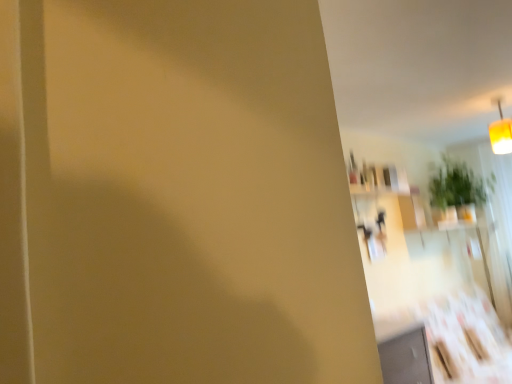
Question: From the image's perspective, relative to green leafy plant at upper right, is yellow fabric lampshade at upper right above or below?

Choices:
 (A) below
 (B) above

Answer: (B)

Question: Considering the positions of yellow fabric lampshade at upper right and green leafy plant at upper right in the image, is yellow fabric lampshade at upper right wider or thinner than green leafy plant at upper right?

Choices:
 (A) wide
 (B) thin

Answer: (B)

Question: From a real-world perspective, is yellow fabric lampshade at upper right above or below green leafy plant at upper right?

Choices:
 (A) above
 (B) below

Answer: (A)

Question: Relative to yellow fabric lampshade at upper right, is green leafy plant at upper right in front or behind?

Choices:
 (A) front
 (B) behind

Answer: (B)

Question: From the image's perspective, relative to yellow fabric lampshade at upper right, is green leafy plant at upper right above or below?

Choices:
 (A) above
 (B) below

Answer: (B)

Question: Looking at their shapes, would you say green leafy plant at upper right is wider or thinner than yellow fabric lampshade at upper right?

Choices:
 (A) wide
 (B) thin

Answer: (A)

Question: Is green leafy plant at upper right spatially inside yellow fabric lampshade at upper right, or outside of it?

Choices:
 (A) inside
 (B) outside

Answer: (B)